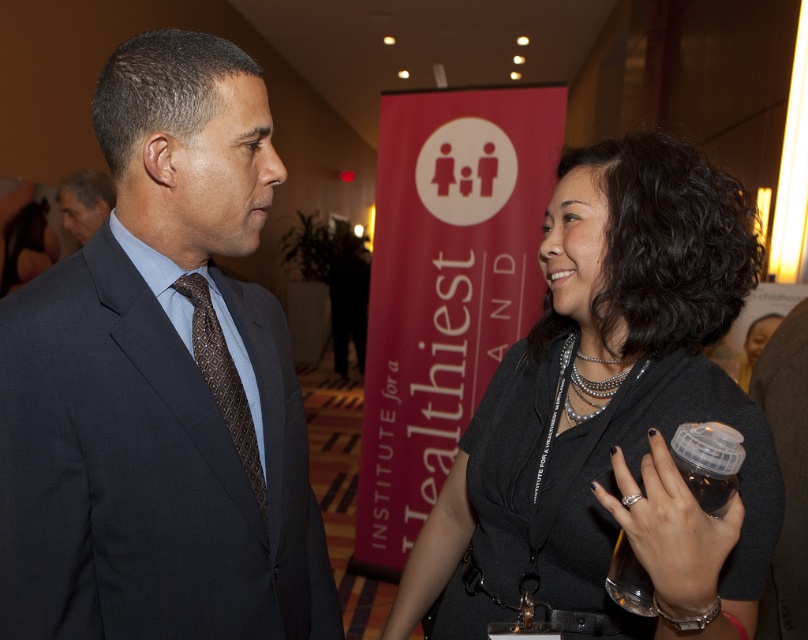
Looking at this image, does dark gray suit at left appear on the right side of black fabric shirt at center?

No, dark gray suit at left is not to the right of black fabric shirt at center.

Is dark gray suit at left to the left of black fabric shirt at center from the viewer's perspective?

Indeed, dark gray suit at left is positioned on the left side of black fabric shirt at center.

Between point (19, 390) and point (588, 227), which one is positioned behind?

Positioned behind is point (588, 227).

You are a GUI agent. You are given a task and a screenshot of the screen. Output one action in this format:
    pyautogui.click(x=<x>, y=<y>)
    Task: Click on the dark gray suit at left
    
    Given the screenshot: What is the action you would take?
    pyautogui.click(x=161, y=385)

Does black fabric shirt at center have a greater height compared to brown textured tie at left?

Correct, black fabric shirt at center is much taller as brown textured tie at left.

Can you confirm if black fabric shirt at center is positioned below brown textured tie at left?

Correct, black fabric shirt at center is located below brown textured tie at left.

Which is in front, point (524, 408) or point (203, 337)?

Point (203, 337) is more forward.

Find the location of a particular element. This screenshot has width=808, height=640. black fabric shirt at center is located at coordinates (609, 412).

Which is above, dark gray suit at left or matte black suit at left?

matte black suit at left

Identify the location of dark gray suit at left. The image size is (808, 640). (161, 385).

In order to click on dark gray suit at left in this screenshot , I will do `click(161, 385)`.